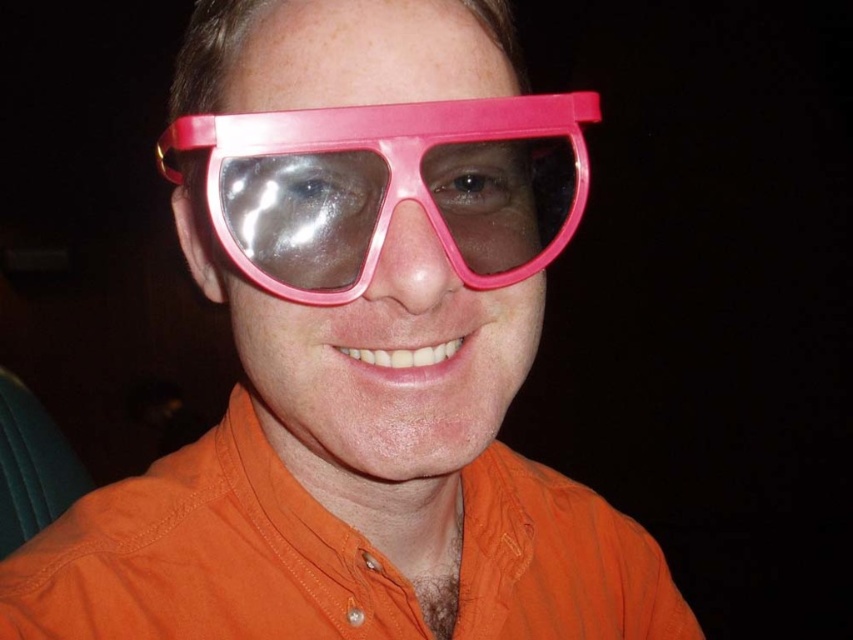
Question: Can you confirm if orange cotton shirt at center is smaller than pink plastic goggles at center?

Choices:
 (A) no
 (B) yes

Answer: (A)

Question: Which object appears farthest from the camera in this image?

Choices:
 (A) pink plastic goggles at center
 (B) orange cotton shirt at center

Answer: (B)

Question: Does orange cotton shirt at center have a greater width compared to pink plastic goggles at center?

Choices:
 (A) no
 (B) yes

Answer: (B)

Question: Can you confirm if orange cotton shirt at center is positioned above pink plastic goggles at center?

Choices:
 (A) no
 (B) yes

Answer: (A)

Question: Which of the following is the closest to the observer?

Choices:
 (A) orange cotton shirt at center
 (B) pink plastic goggles at center

Answer: (B)